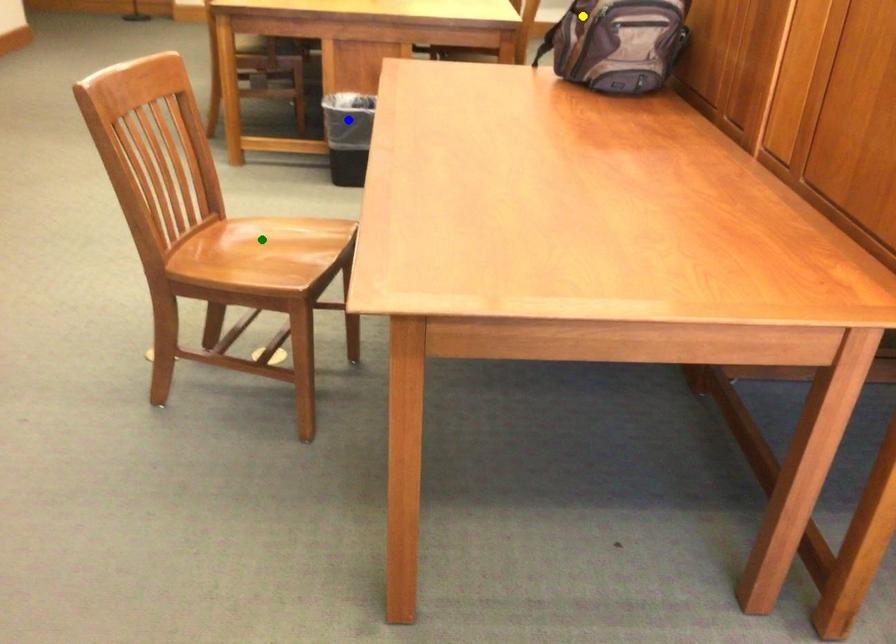
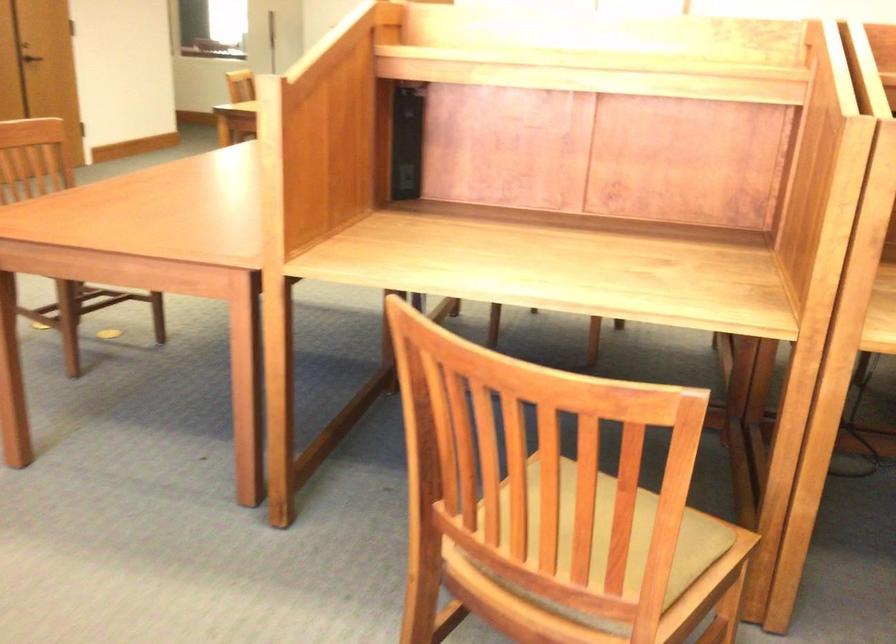
I am providing you with two images of the same scene from different viewpoints. Three points are marked in image1. Which point corresponds to a part or object that is occluded in image2?In image1, three points are marked. Which of them correspond to a part or object that is occluded in image2?Among the three points shown in image1, which one corresponds to a part or object that is no longer visible due to occlusion in image2?

yellow point, blue point, green point